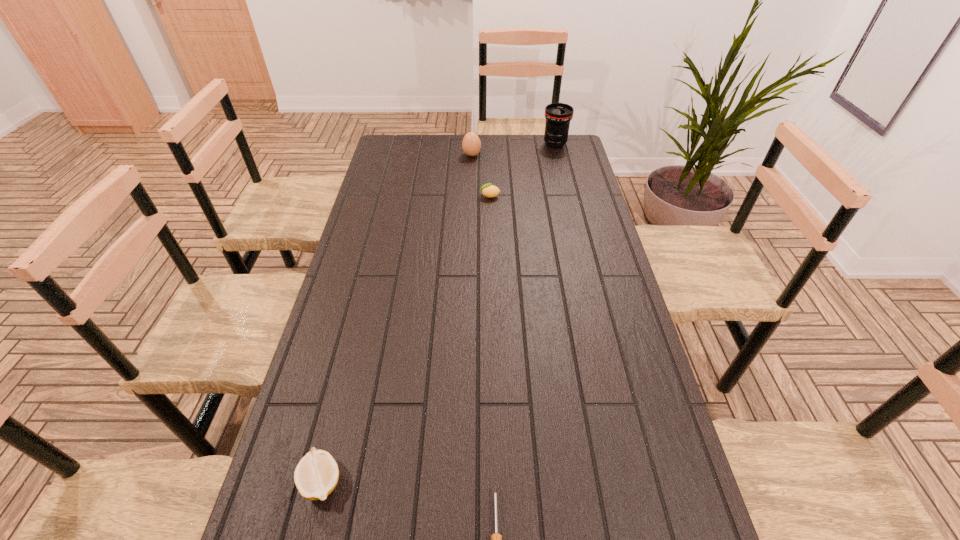
The image size is (960, 540). Find the location of `vacant region located with leaves positioned above the farther lemon`. vacant region located with leaves positioned above the farther lemon is located at coordinates (403, 196).

The width and height of the screenshot is (960, 540). What are the coordinates of `vacant space situated with leaves positioned above the farther lemon` in the screenshot? It's located at (400, 196).

Locate an element on the screen. free spot located on the right of the left lemon is located at coordinates (465, 481).

Image resolution: width=960 pixels, height=540 pixels. I want to click on telephoto lens at the far edge, so click(558, 115).

Identify the location of boiled egg located at the far edge. (471, 144).

At what (x,y) coordinates should I click in order to perform the action: click on object present at the left edge. Please return your answer as a coordinate pair (x, y). This screenshot has height=540, width=960. Looking at the image, I should click on (316, 475).

Where is `object located in the right edge section of the desktop`? The image size is (960, 540). object located in the right edge section of the desktop is located at coordinates (558, 115).

Find the location of a particular element. The width and height of the screenshot is (960, 540). object situated at the far right corner is located at coordinates (558, 115).

At what (x,y) coordinates should I click in order to perform the action: click on free space at the far edge. Please return your answer as a coordinate pair (x, y). Looking at the image, I should click on [x=426, y=141].

Identify the location of free space at the left edge of the desktop. The image size is (960, 540). (371, 241).